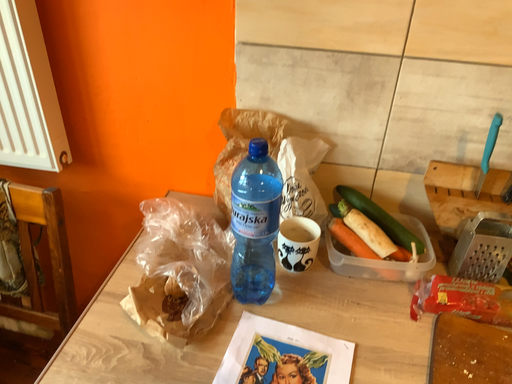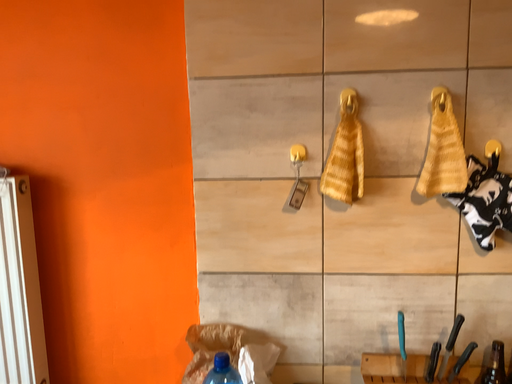
Question: Which way did the camera rotate in the video?

Choices:
 (A) rotated upward
 (B) rotated downward

Answer: (A)